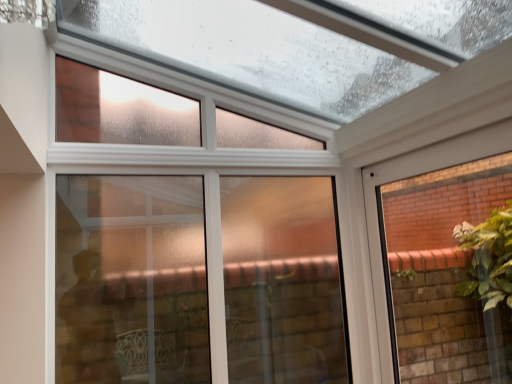
Where is `clear glass window at upper center`? The width and height of the screenshot is (512, 384). clear glass window at upper center is located at coordinates (197, 280).

The height and width of the screenshot is (384, 512). What do you see at coordinates (197, 280) in the screenshot?
I see `clear glass window at upper center` at bounding box center [197, 280].

You are a GUI agent. You are given a task and a screenshot of the screen. Output one action in this format:
    pyautogui.click(x=<x>, y=<y>)
    Task: Click on the clear glass window at upper center
    The image size is (512, 384).
    Given the screenshot: What is the action you would take?
    pyautogui.click(x=197, y=280)